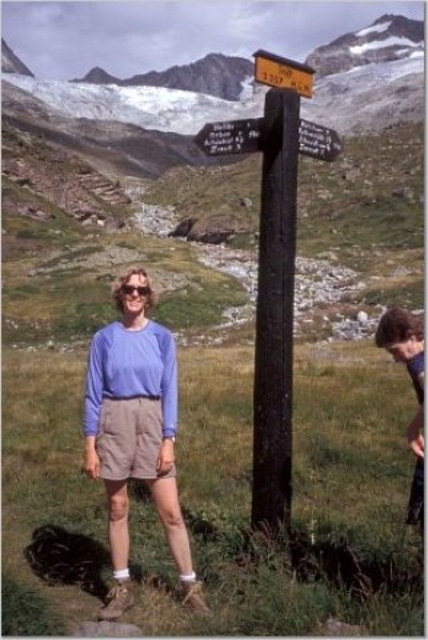
You are planning to hang a small birdhouse on the wooden post at center and the yellow wooden signpost at center. Which one can accommodate the birdhouse without exceeding its width?

The yellow wooden signpost at center can accommodate the birdhouse since its width is greater than the wooden post at center.

Where is the dark brown wood post at center located in the image?

The dark brown wood post at center is located at point [275,310].

You are a hiker who wants to determine the tallest post in the area. You see a dark brown wood post at center and a wooden post at center. Which one is taller?

The wooden post at center is taller than the dark brown wood post at center.